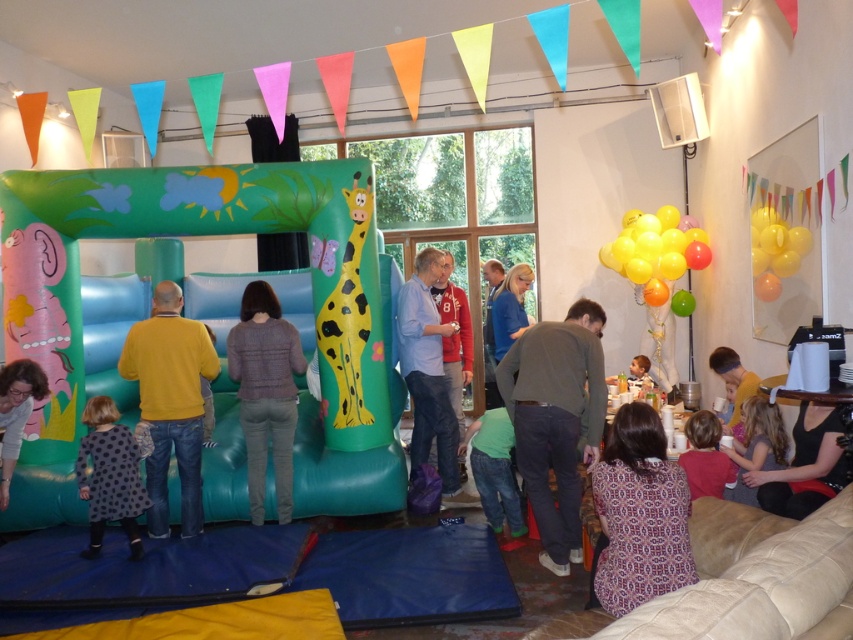
You are a guest at the party and want to take a photo with both the shiny metallic balloons at upper right and the green matte jeans at lower center in the background. Which object should you position closer to the camera to ensure both appear in the frame?

You should position yourself closer to the shiny metallic balloons at upper right since it is taller than the green matte jeans at lower center, ensuring both objects are visible in the photo.

You are a guest at the party and want to hang a new flag between the shiny metallic balloons at upper right and the green matte jeans at lower center. Which object should you place the flag closer to if you want the flag to be near the wider object?

The shiny metallic balloons at upper right are wider than the green matte jeans at lower center, so you should place the flag closer to the shiny metallic balloons at upper right.

You are a guest at the party and want to take a photo of the brown cotton shirt at center and the shiny metallic balloons at upper right. Which object will appear larger in your photo?

The brown cotton shirt at center will appear larger in the photo because it is closer to the viewer than the shiny metallic balloons at upper right.